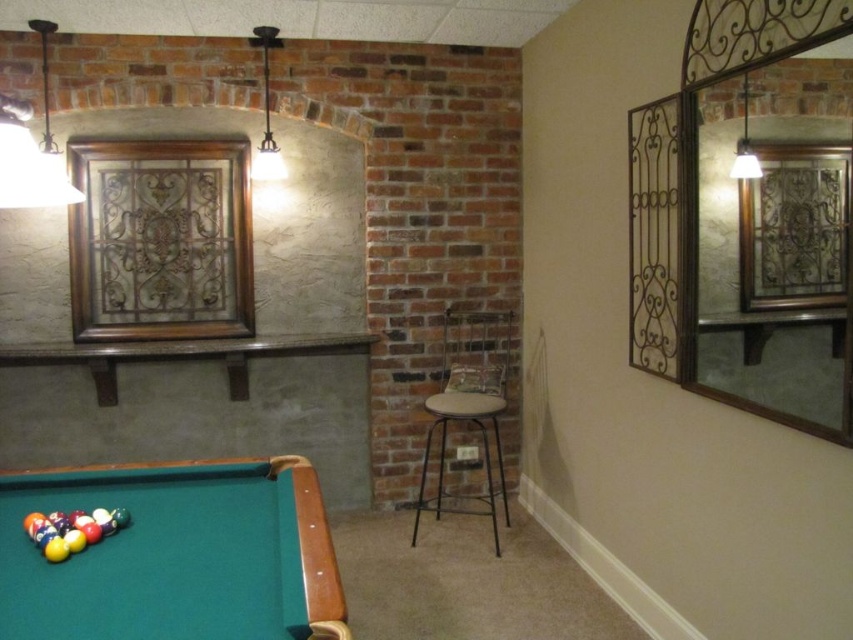
You are a delivery person who needs to place a package on the floor between the green felt pool table at lower left and the metallic black bar stool at center. The package requires 1.6 meters of space to be placed safely. Is there enough space between them?

The distance between the green felt pool table at lower left and the metallic black bar stool at center is 1.58 meters, which is slightly less than the required 1.6 meters. Therefore, there isn not enough space to safely place the package between them.

In the scene shown: You are a delivery person trying to bring a large package into the game room. The package is as wide as the metallic black bar stool at center. Can you fit the package through the doorway without rotating it, considering the space next to the green felt pool table at lower left?

The green felt pool table at lower left is wider than the metallic black bar stool at center. Since the package is as wide as the stool, it should fit through the doorway as the table itself is wider, implying the doorway is at least as wide as the table.

You are a delivery person who needs to place a large package that is 1.2 meters wide between the green felt pool table at lower left and the metallic black bar stool at center. Can you fit the package in that space?

The green felt pool table at lower left is in front of the metallic black bar stool at center, meaning there is no space between them to place the package. The package cannot be placed there.